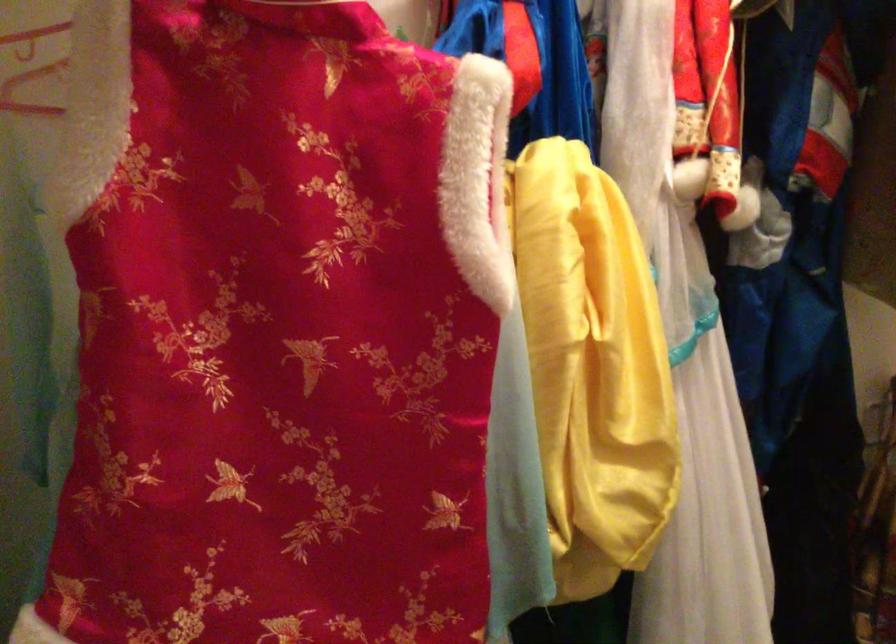
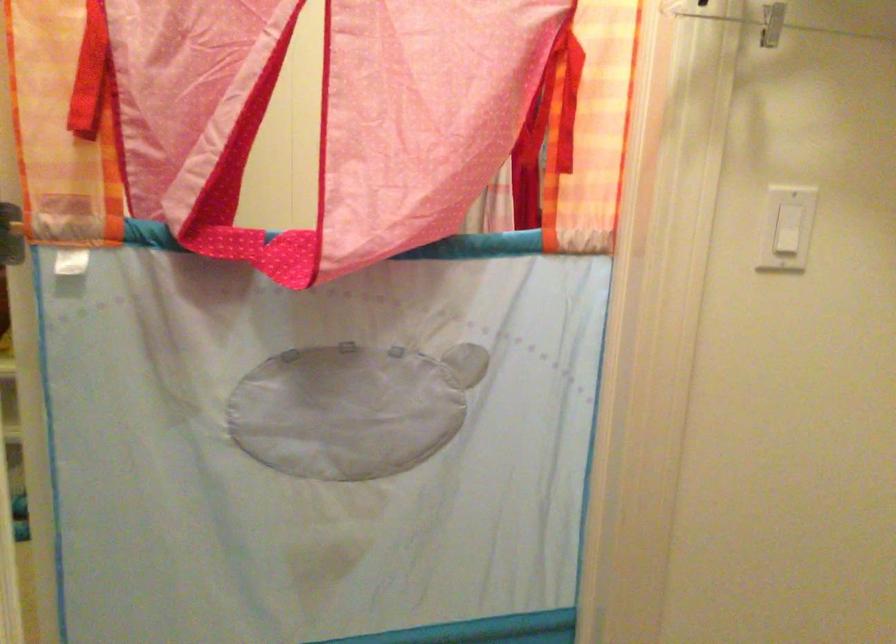
Question: The camera is either moving clockwise (left) or counter-clockwise (right) around the object. The first image is from the beginning of the video and the second image is from the end. Is the camera moving left or right when shooting the video?

Choices:
 (A) Left
 (B) Right

Answer: (A)